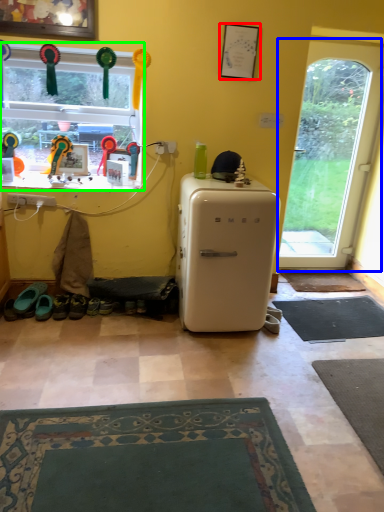
Question: Which is nearer to the picture frame (highlighted by a red box)? door (highlighted by a blue box) or window (highlighted by a green box).

Choices:
 (A) door
 (B) window

Answer: (B)